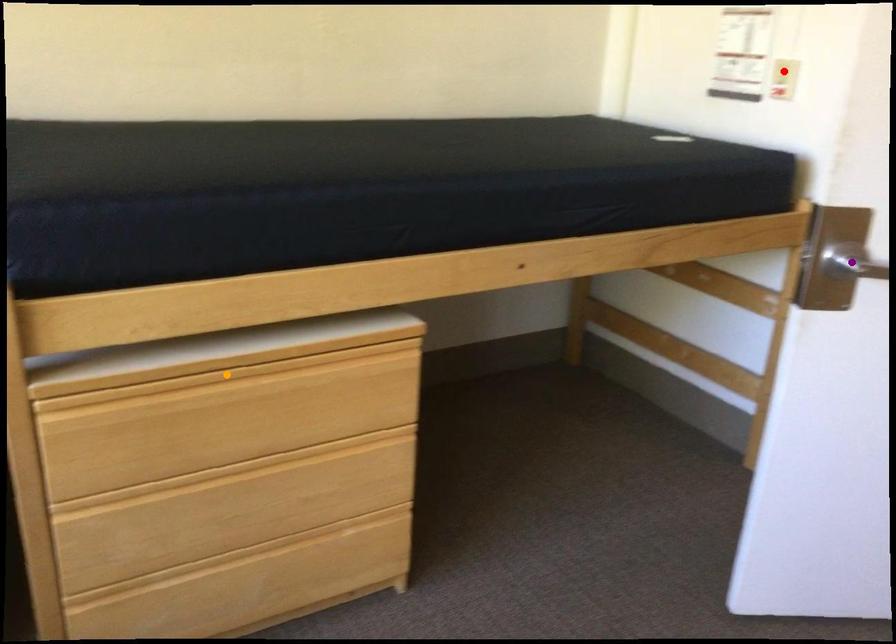
Order these from nearest to farthest:
orange point | purple point | red point

A: red point, purple point, orange point